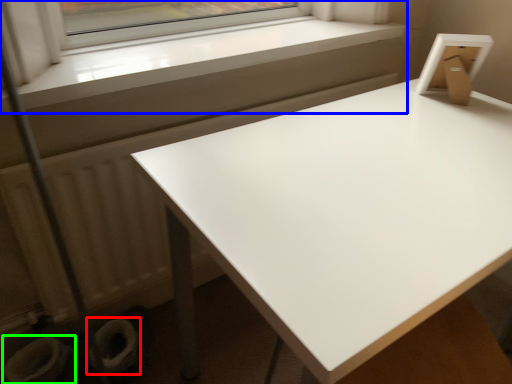
Question: Based on their relative distances, which object is nearer to toilet bowl (highlighted by a red box)? Choose from window (highlighted by a blue box) and toilet bowl (highlighted by a green box).

Choices:
 (A) window
 (B) toilet bowl

Answer: (B)